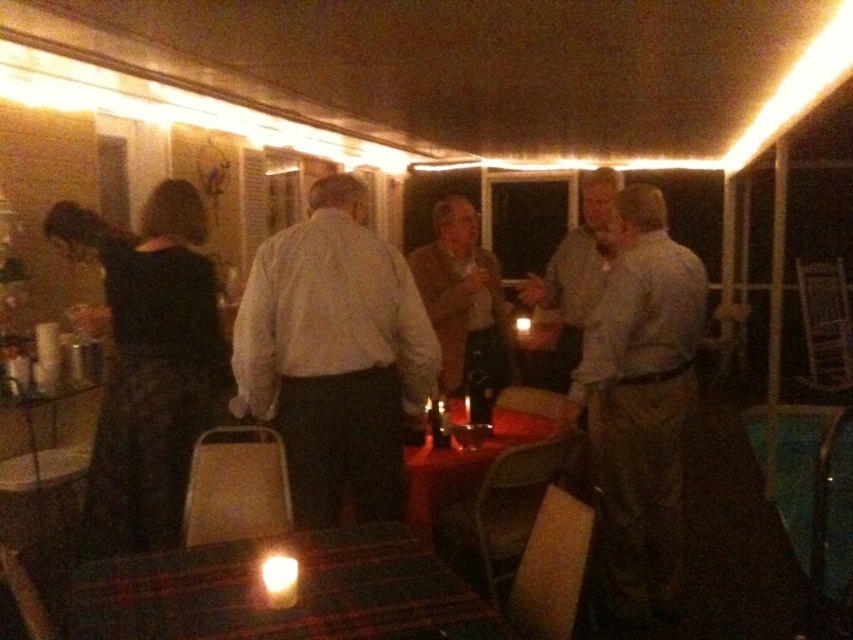
Does brown leather jacket at center appear on the right side of wooden table at center?

In fact, brown leather jacket at center is to the left of wooden table at center.

Can you confirm if brown leather jacket at center is positioned above wooden table at center?

Indeed, brown leather jacket at center is positioned over wooden table at center.

Locate an element on the screen. Image resolution: width=853 pixels, height=640 pixels. brown leather jacket at center is located at coordinates [465, 307].

Consider the image. Does white matte shirt at center have a greater height compared to light brown shirt at center?

Yes, white matte shirt at center is taller than light brown shirt at center.

Between white matte shirt at center and light brown shirt at center, which one is positioned lower?

Positioned lower is white matte shirt at center.

You are a GUI agent. You are given a task and a screenshot of the screen. Output one action in this format:
    pyautogui.click(x=<x>, y=<y>)
    Task: Click on the white matte shirt at center
    The image size is (853, 640).
    Given the screenshot: What is the action you would take?
    pyautogui.click(x=334, y=356)

Locate an element on the screen. Image resolution: width=853 pixels, height=640 pixels. white matte shirt at center is located at coordinates (334, 356).

Which is behind, point (619, 556) or point (589, 186)?

The point (589, 186) is behind.

Can you confirm if light gray shirt at right is positioned to the left of light brown shirt at center?

No, light gray shirt at right is not to the left of light brown shirt at center.

Which is behind, point (612, 560) or point (572, 346)?

Positioned behind is point (572, 346).

Where is `light gray shirt at right`? light gray shirt at right is located at coordinates (640, 403).